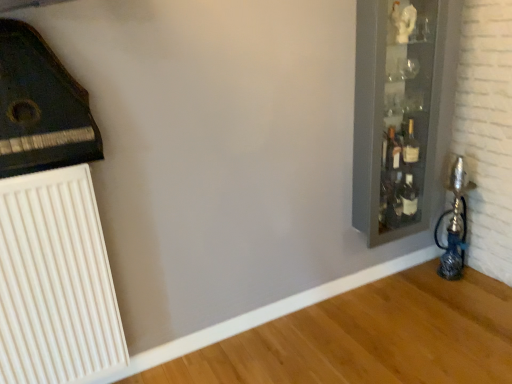
Question: From the image's perspective, is white plastic radiator at lower left below clear glass cabinet at right?

Choices:
 (A) no
 (B) yes

Answer: (B)

Question: Are white plastic radiator at lower left and clear glass cabinet at right located far from each other?

Choices:
 (A) yes
 (B) no

Answer: (A)

Question: Is white plastic radiator at lower left not inside clear glass cabinet at right?

Choices:
 (A) yes
 (B) no

Answer: (A)

Question: From a real-world perspective, is white plastic radiator at lower left beneath clear glass cabinet at right?

Choices:
 (A) yes
 (B) no

Answer: (A)

Question: Considering the relative positions of white plastic radiator at lower left and clear glass cabinet at right in the image provided, is white plastic radiator at lower left behind clear glass cabinet at right?

Choices:
 (A) yes
 (B) no

Answer: (B)

Question: Looking at their shapes, would you say clear glass cabinet at right is wider or thinner than white plastic radiator at lower left?

Choices:
 (A) thin
 (B) wide

Answer: (B)

Question: From the image's perspective, is clear glass cabinet at right positioned above or below white plastic radiator at lower left?

Choices:
 (A) below
 (B) above

Answer: (B)

Question: Considering the positions of point (376, 125) and point (35, 292), is point (376, 125) closer or farther from the camera than point (35, 292)?

Choices:
 (A) farther
 (B) closer

Answer: (A)

Question: Which is correct: clear glass cabinet at right is inside white plastic radiator at lower left, or outside of it?

Choices:
 (A) inside
 (B) outside

Answer: (B)

Question: Is point (387, 162) positioned closer to the camera than point (96, 264)?

Choices:
 (A) farther
 (B) closer

Answer: (A)

Question: Choose the correct answer: Is translucent glass bottle at right inside white plastic radiator at lower left or outside it?

Choices:
 (A) inside
 (B) outside

Answer: (B)

Question: In the image, is translucent glass bottle at right on the left side or the right side of white plastic radiator at lower left?

Choices:
 (A) left
 (B) right

Answer: (B)

Question: Considering the positions of translucent glass bottle at right and white plastic radiator at lower left in the image, is translucent glass bottle at right taller or shorter than white plastic radiator at lower left?

Choices:
 (A) short
 (B) tall

Answer: (A)

Question: Is white plastic radiator at lower left situated inside translucent glass bottle at right or outside?

Choices:
 (A) outside
 (B) inside

Answer: (A)

Question: Is white plastic radiator at lower left in front of or behind translucent glass bottle at right in the image?

Choices:
 (A) front
 (B) behind

Answer: (A)